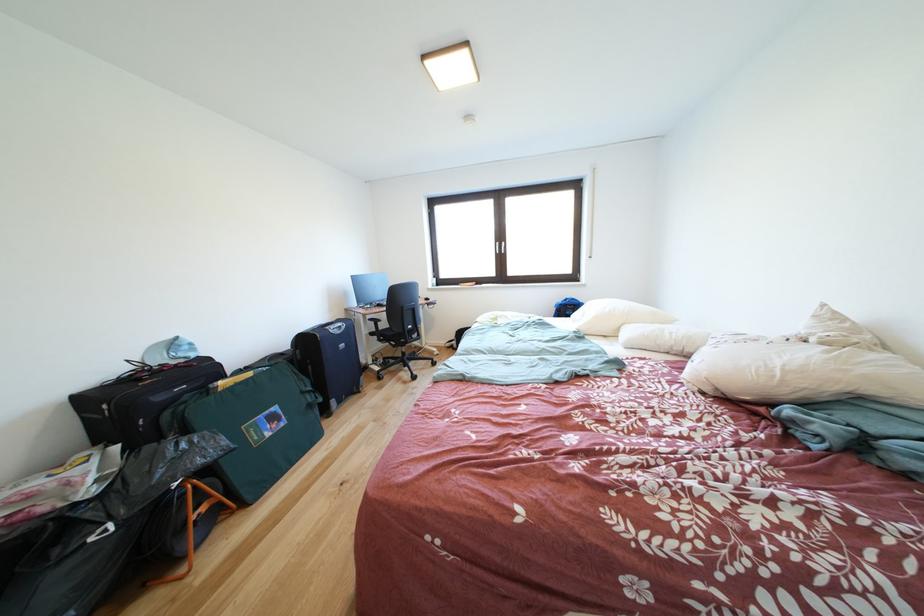
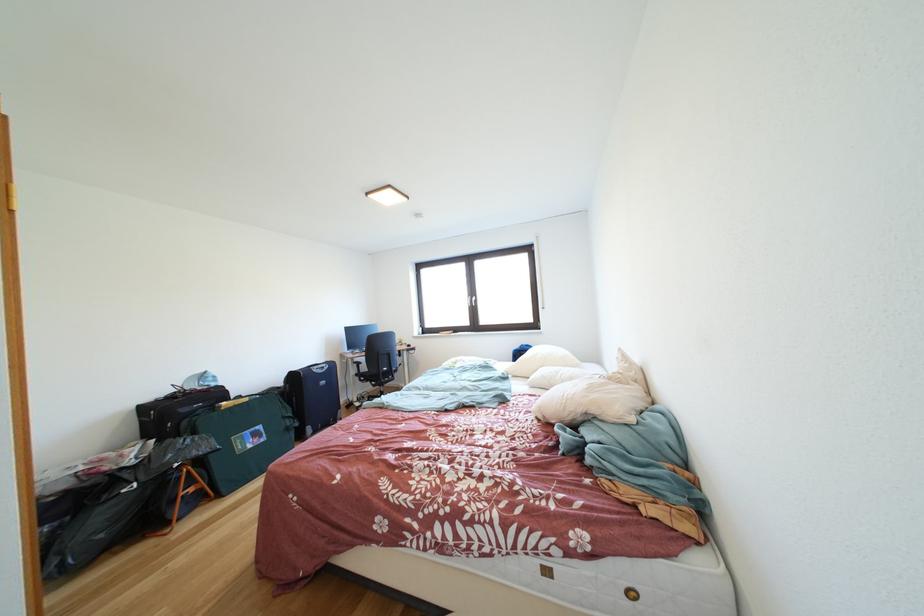
Locate, in the second image, the point that corresponds to the point at 716,394 in the first image.

(549, 421)